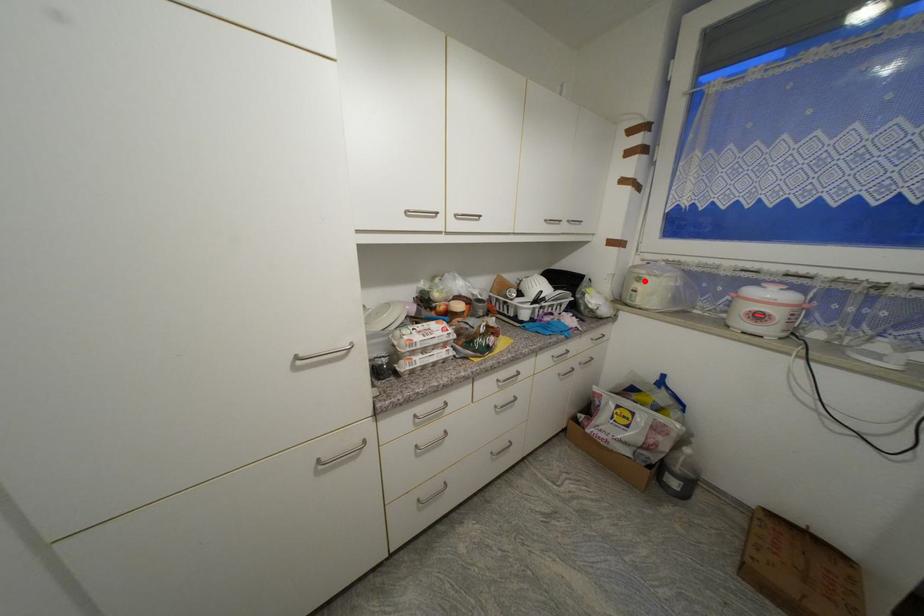
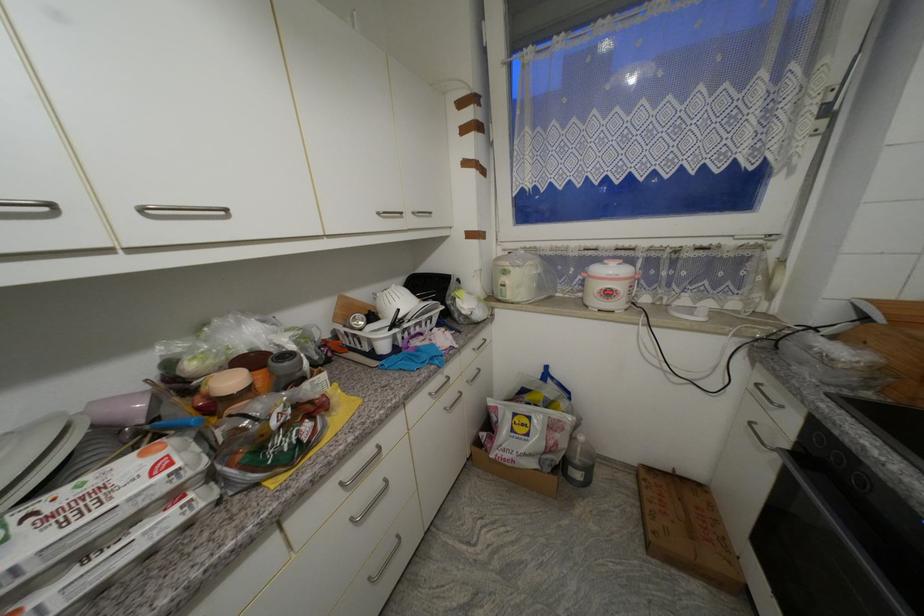
Find the pixel in the second image that matches the highlighted location in the first image.

(511, 274)